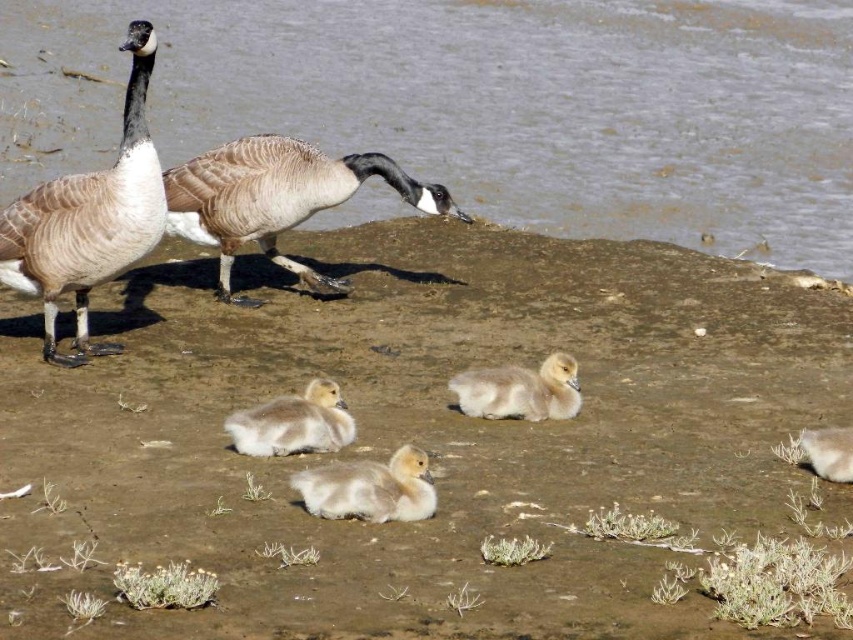
Question: Among these points, which one is farthest from the camera?

Choices:
 (A) (635, 17)
 (B) (828, 458)
 (C) (480, 412)

Answer: (A)

Question: Does brown sandy ground at center lie in front of brown feathered goose at left?

Choices:
 (A) no
 (B) yes

Answer: (B)

Question: Which of the following is the farthest from the observer?

Choices:
 (A) brown feathered goose at center
 (B) fluffy white gosling at center
 (C) clear water at upper center
 (D) brown sandy ground at center

Answer: (C)

Question: Does brown sandy ground at center have a larger size compared to clear water at upper center?

Choices:
 (A) no
 (B) yes

Answer: (A)

Question: Estimate the real-world distances between objects in this image. Which object is farther from the white fluffy duckling at lower right?

Choices:
 (A) brown feathered goose at center
 (B) brown feathered goose at left

Answer: (B)

Question: Can you confirm if brown feathered goose at center is positioned to the right of white fluffy duckling at lower right?

Choices:
 (A) no
 (B) yes

Answer: (A)